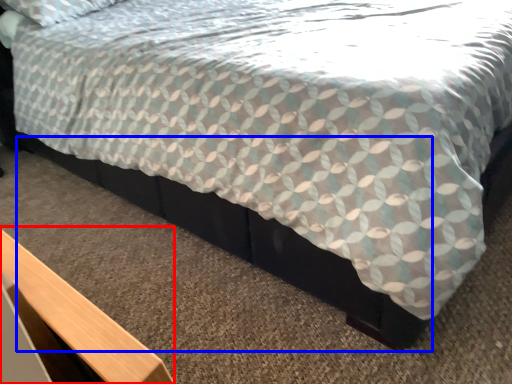
Question: Among these objects, which one is nearest to the camera, table (highlighted by a red box) or bed frame (highlighted by a blue box)?

Choices:
 (A) table
 (B) bed frame

Answer: (A)